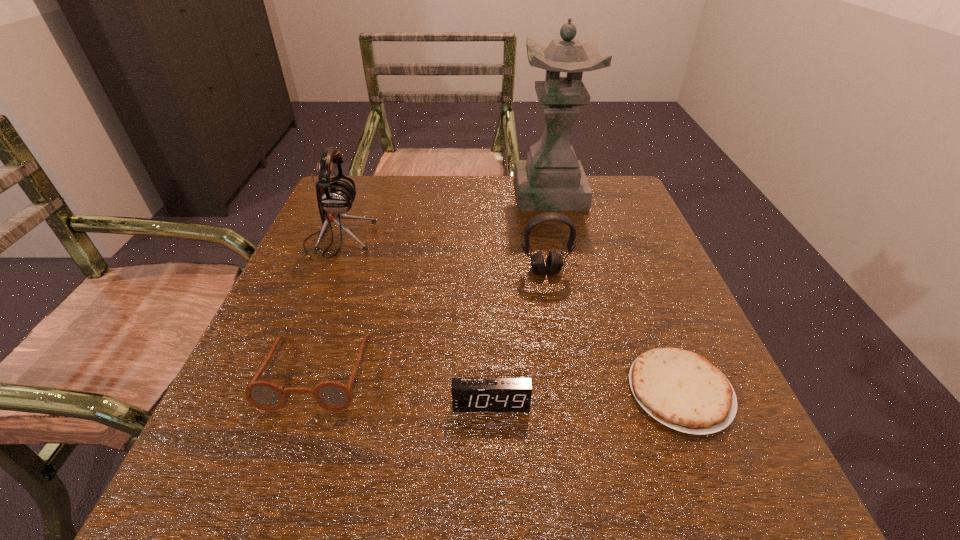
Locate an element on the screen. Image resolution: width=960 pixels, height=540 pixels. vacant space situated 0.240m at the front opening of the sculpture is located at coordinates (426, 193).

Find the location of a particular element. This screenshot has height=540, width=960. vacant space located 0.240m at the front opening of the sculpture is located at coordinates (426, 193).

Locate an element on the screen. This screenshot has height=540, width=960. vacant area situated on the back of the second tallest object is located at coordinates (352, 205).

The width and height of the screenshot is (960, 540). In order to click on vacant region located on the front-facing side of the fourth shortest object in this screenshot , I will do `click(563, 367)`.

You are a GUI agent. You are given a task and a screenshot of the screen. Output one action in this format:
    pyautogui.click(x=<x>, y=<y>)
    Task: Click on the vacant area located on the front-facing side of the third object from left to right
    Image resolution: width=960 pixels, height=540 pixels.
    Given the screenshot: What is the action you would take?
    pyautogui.click(x=492, y=456)

The image size is (960, 540). Find the location of `blank space located on the front-facing side of the spectacles`. blank space located on the front-facing side of the spectacles is located at coordinates (274, 500).

At what (x,y) coordinates should I click in order to perform the action: click on vacant space situated 0.080m on the back of the shortest object. Please return your answer as a coordinate pair (x, y). This screenshot has height=540, width=960. Looking at the image, I should click on (651, 318).

Image resolution: width=960 pixels, height=540 pixels. In order to click on sculpture present at the far edge in this screenshot , I will do `click(551, 179)`.

Locate an element on the screen. The width and height of the screenshot is (960, 540). earphone that is at the far edge is located at coordinates (335, 195).

Locate an element on the screen. earphone located in the left edge section of the desktop is located at coordinates (335, 195).